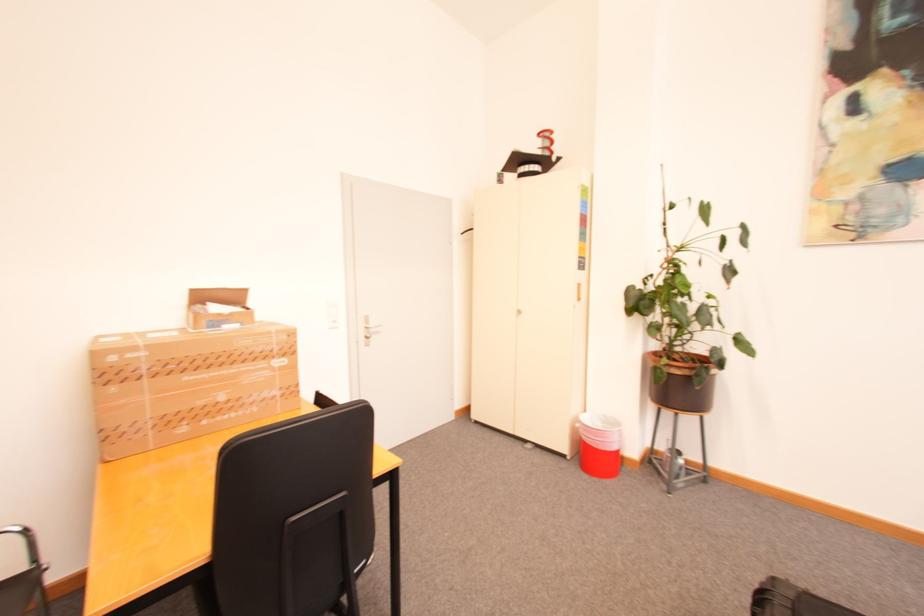
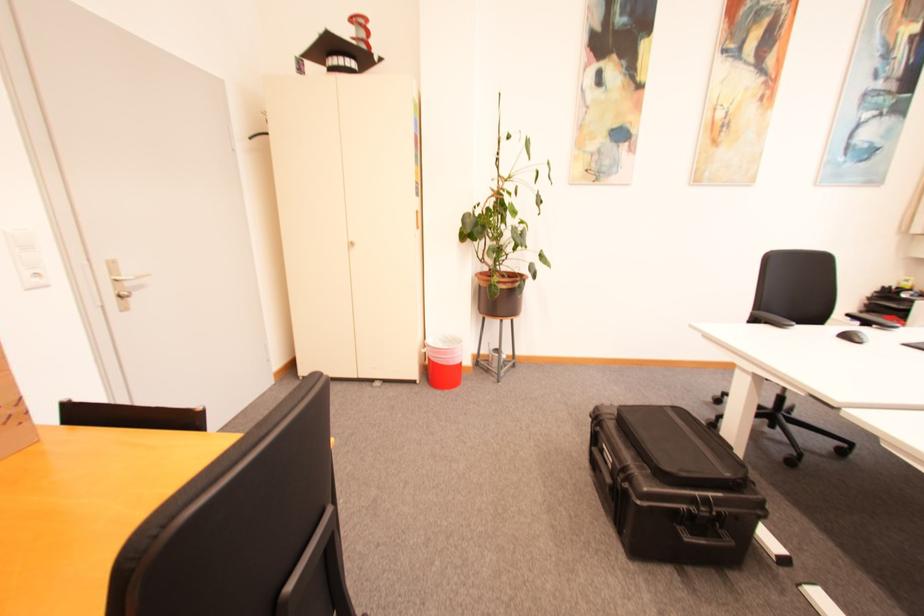
In the second image, find the point that corresponds to point 526,313 in the first image.

(359, 245)